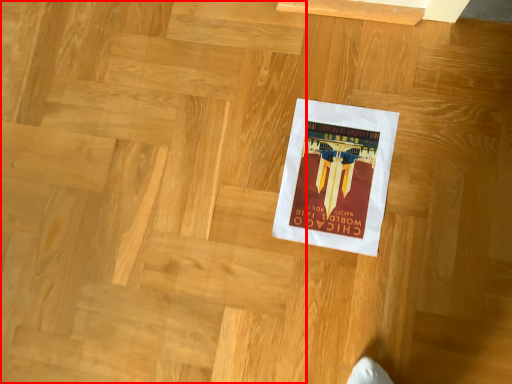
Question: From the image's perspective, considering the relative positions of stairwell (annotated by the red box) and poster in the image provided, where is stairwell (annotated by the red box) located with respect to the staircase?

Choices:
 (A) above
 (B) below

Answer: (B)